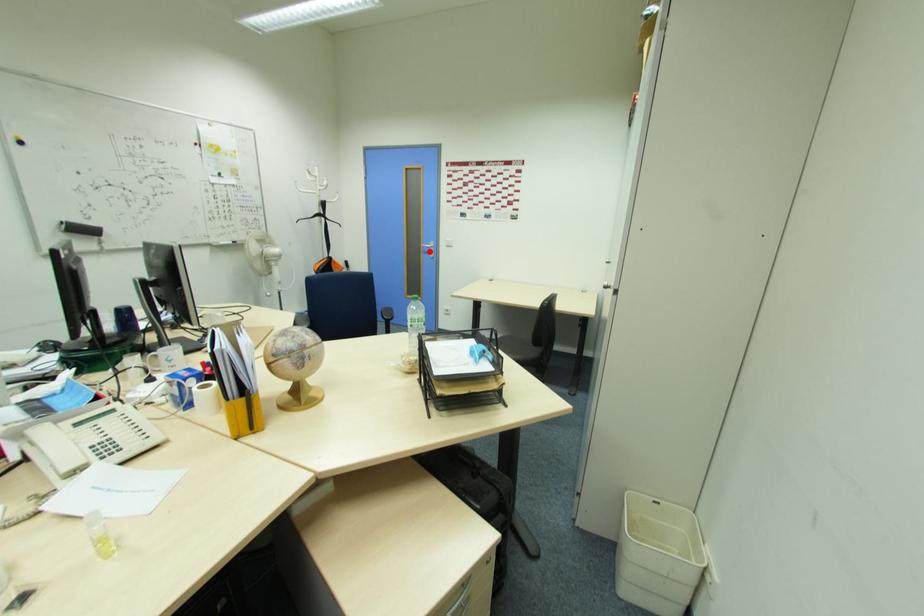
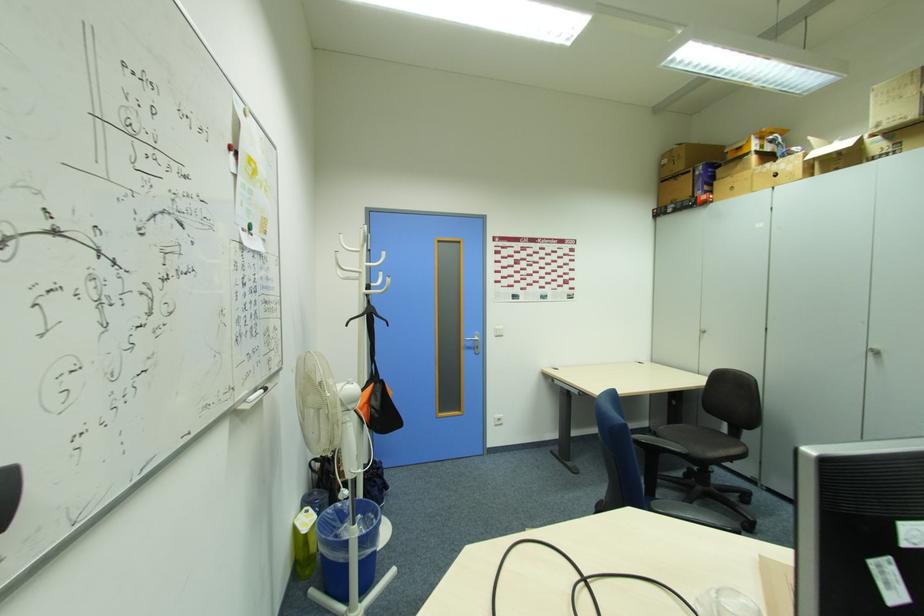
Question: I am providing you with two images of the same scene from different viewpoints. Given a red point in image1, look at the same physical point in image2. Is it:

Choices:
 (A) Closer to the viewpoint
 (B) Farther from the viewpoint

Answer: (B)